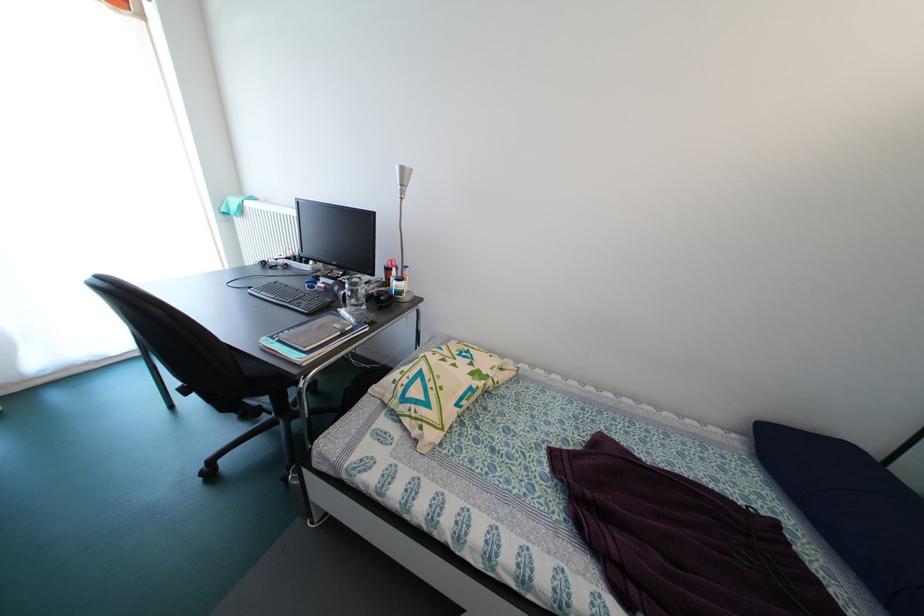
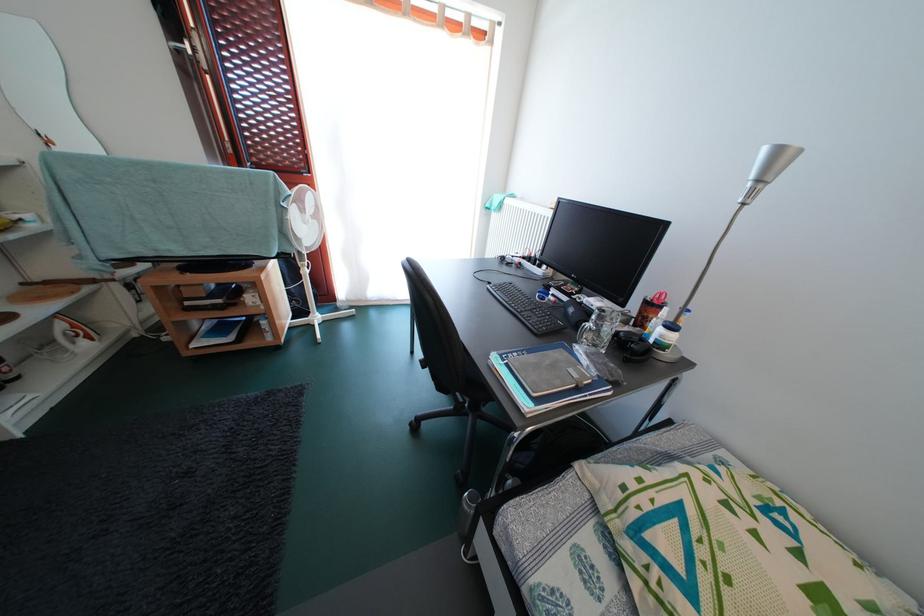
Locate, in the second image, the point that corresponds to point (362, 310) in the first image.

(602, 351)